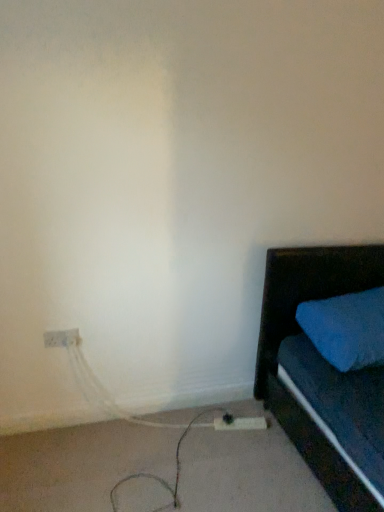
Locate an element on the screen. The height and width of the screenshot is (512, 384). free space to the left of white plastic extension cord at lower center is located at coordinates (196, 425).